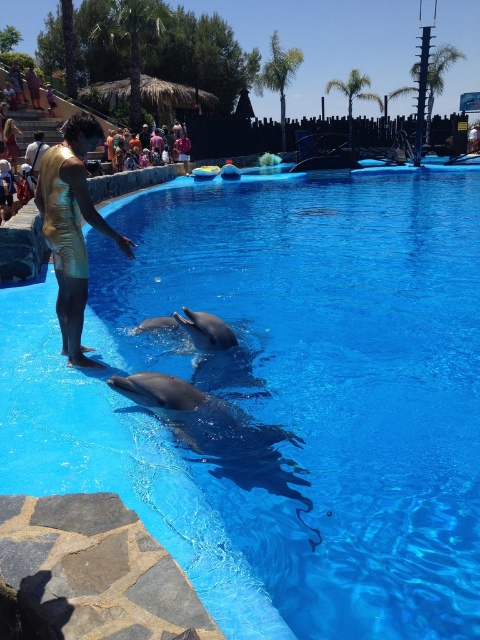
You are a photographer positioned at the center of the pool edge. You want to take a photo of the gold metallic swimsuit at left. Which direction should you pan your camera to capture it?

The gold metallic swimsuit at left is located at point (72, 227), which is to the left of your current position at the center of the pool edge. You should pan your camera to the left to capture it.

You are a photographer positioned at the center of the pool edge. You want to capture a photo of the multicolored fabric crowd at upper center without any obstructions. Which direction should you move to get a clear shot?

You should move to the left to avoid obstructions because the multicolored fabric crowd at upper center is located at point 0.225 on the x axis, which is to the left of the center position.

You are a safety inspector at the marine park. You need to ensure that visitors maintain a minimum distance of 3 meters from the dolphins for safety. A visitor is standing on the pool edge near the gray smooth dolphin at lower center. Is the visitor within the safe distance requirement?

The gray smooth dolphin at lower center and viewer are 3.74 meters apart from each other. Since the minimum required distance is 3 meters, the visitor is within the safe distance as 3.74 meters exceeds the 3 meter requirement.